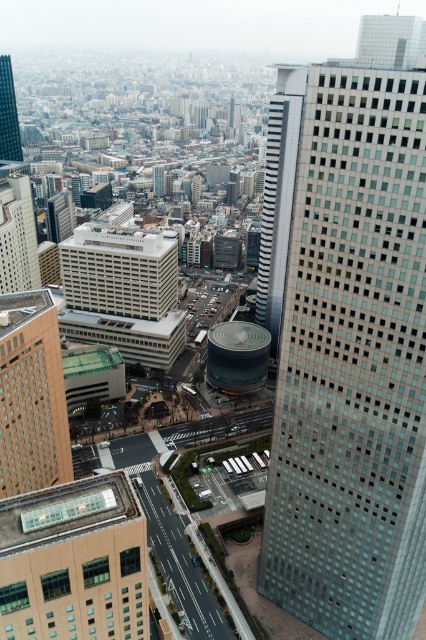
Question: Is white striped tower at center bigger than matte glass skyscraper at left?

Choices:
 (A) yes
 (B) no

Answer: (A)

Question: Does brown textured building at left appear on the right side of white striped tower at center?

Choices:
 (A) yes
 (B) no

Answer: (B)

Question: Which point is closer to the camera?

Choices:
 (A) (0, 140)
 (B) (60, 406)
 (C) (388, 624)
 (D) (2, 241)

Answer: (C)

Question: Based on their relative distances, which object is nearer to the glassy steel skyscraper at right?

Choices:
 (A) matte glass skyscraper at upper left
 (B) beige glass roof at center
 (C) brown textured building at left
 (D) matte glass skyscraper at left

Answer: (B)

Question: Which of these objects is positioned farthest from the beige glass roof at center?

Choices:
 (A) matte glass skyscraper at upper left
 (B) matte glass skyscraper at left

Answer: (A)

Question: Is beige glass roof at center below white striped tower at center?

Choices:
 (A) yes
 (B) no

Answer: (A)